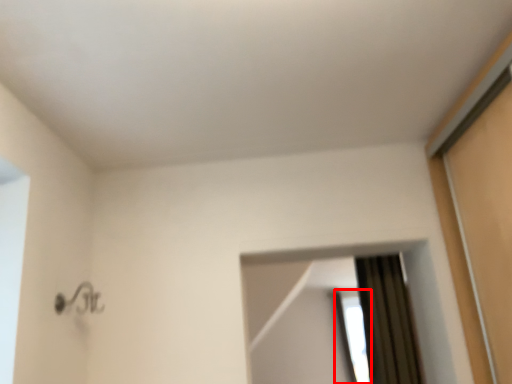
Question: Where is window (annotated by the red box) located in relation to mirror in the image?

Choices:
 (A) right
 (B) left

Answer: (A)